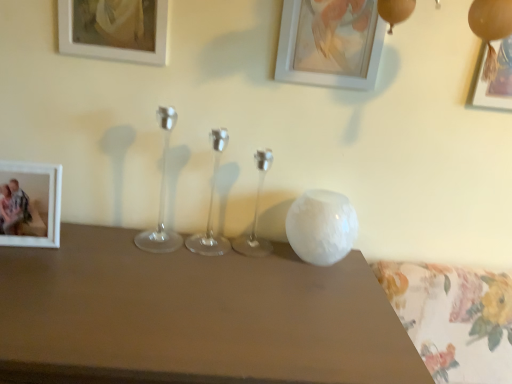
The height and width of the screenshot is (384, 512). Describe the element at coordinates (114, 29) in the screenshot. I see `matte white picture frame at upper left, the second picture frame positioned from the left` at that location.

Where is `white matte picture frame at left, which is the 1th picture frame from left to right`? white matte picture frame at left, which is the 1th picture frame from left to right is located at coordinates (30, 204).

Locate an element on the screen. white matte picture frame at upper center, which is counted as the 3th picture frame, starting from the left is located at coordinates (330, 44).

Looking at the image, does white matte picture frame at upper center, which is counted as the 2th picture frame, starting from the right, seem bigger or smaller compared to white glossy vase at upper right?

Considering their sizes, white matte picture frame at upper center, which is counted as the 2th picture frame, starting from the right, takes up less space than white glossy vase at upper right.

Can you confirm if white matte picture frame at upper center, which is counted as the 2th picture frame, starting from the right, is thinner than white glossy vase at upper right?

Yes.

Can white glossy vase at upper right be found inside white matte picture frame at upper center, which is counted as the 2th picture frame, starting from the right?

No, white glossy vase at upper right is not inside white matte picture frame at upper center, which is counted as the 2th picture frame, starting from the right.

Does white matte picture frame at upper center, which is counted as the 3th picture frame, starting from the left, lie behind white glossy vase at upper right?

Yes.

From the image's perspective, is white glossy vase at upper right on metallic gold picture frame at upper right, the 1th picture frame viewed from the right?

No.

Is point (156, 330) positioned in front of point (495, 83)?

That is True.

Locate an element on the screen. This screenshot has height=384, width=512. table located underneath the metallic gold picture frame at upper right, the 1th picture frame viewed from the right (from a real-world perspective) is located at coordinates (193, 317).

Is white glossy vase at upper right turned away from metallic gold picture frame at upper right, arranged as the fourth picture frame when viewed from the left?

No, white glossy vase at upper right is not facing away from metallic gold picture frame at upper right, arranged as the fourth picture frame when viewed from the left.

From the image's perspective, would you say white matte picture frame at upper center, which is counted as the 2th picture frame, starting from the right, is positioned over white matte picture frame at left, which is the 1th picture frame from left to right?

Yes, from the image's perspective, white matte picture frame at upper center, which is counted as the 2th picture frame, starting from the right, is over white matte picture frame at left, which is the 1th picture frame from left to right.

How distant is white matte picture frame at upper center, which is counted as the 3th picture frame, starting from the left, from white matte picture frame at left, which is the 1th picture frame from left to right?

white matte picture frame at upper center, which is counted as the 3th picture frame, starting from the left, and white matte picture frame at left, which is the 1th picture frame from left to right, are 26.77 inches apart.

Which is further, [303,79] or [24,193]?

Positioned behind is point [303,79].

From a real-world perspective, is matte white picture frame at upper left, the second picture frame positioned from the left, physically above white matte picture frame at upper center, which is counted as the 2th picture frame, starting from the right?

Yes, from a real-world perspective, matte white picture frame at upper left, the second picture frame positioned from the left, is over white matte picture frame at upper center, which is counted as the 2th picture frame, starting from the right

Is point (127, 48) more distant than point (349, 83)?

No, it is not.

Does matte white picture frame at upper left, the second picture frame positioned from the left, have a lesser height compared to white matte picture frame at upper center, which is counted as the 2th picture frame, starting from the right?

Yes, matte white picture frame at upper left, the second picture frame positioned from the left, is shorter than white matte picture frame at upper center, which is counted as the 2th picture frame, starting from the right.

Where is `the 1st picture frame positioned below the matte white picture frame at upper left, the second picture frame positioned from the left (from the image's perspective)`? The width and height of the screenshot is (512, 384). the 1st picture frame positioned below the matte white picture frame at upper left, the second picture frame positioned from the left (from the image's perspective) is located at coordinates 330,44.

From the picture: Is matte white picture frame at upper left, which ranks as the 3th picture frame in right-to-left order, beside white matte picture frame at left, which is the 1th picture frame from left to right?

No, matte white picture frame at upper left, which ranks as the 3th picture frame in right-to-left order, is not touching white matte picture frame at left, which is the 1th picture frame from left to right.

Considering the relative sizes of matte white picture frame at upper left, the second picture frame positioned from the left, and white matte picture frame at left, which is the 4th picture frame in right-to-left order, in the image provided, is matte white picture frame at upper left, the second picture frame positioned from the left, wider than white matte picture frame at left, which is the 4th picture frame in right-to-left order,?

In fact, matte white picture frame at upper left, the second picture frame positioned from the left, might be narrower than white matte picture frame at left, which is the 4th picture frame in right-to-left order.

Looking at this image, can you tell me how much matte white picture frame at upper left, the second picture frame positioned from the left, and white matte picture frame at left, which is the 4th picture frame in right-to-left order, differ in facing direction?

The angle between the facing direction of matte white picture frame at upper left, the second picture frame positioned from the left, and the facing direction of white matte picture frame at left, which is the 4th picture frame in right-to-left order, is 4.86 degrees.

From a real-world perspective, is matte white picture frame at upper left, which ranks as the 3th picture frame in right-to-left order, positioned above or below white matte picture frame at left, which is the 1th picture frame from left to right?

Clearly, from a real-world perspective, matte white picture frame at upper left, which ranks as the 3th picture frame in right-to-left order, is above white matte picture frame at left, which is the 1th picture frame from left to right.

Considering the positions of objects white matte picture frame at left, which is the 1th picture frame from left to right, and white matte picture frame at upper center, which is counted as the 3th picture frame, starting from the left, in the image provided, who is more to the right, white matte picture frame at left, which is the 1th picture frame from left to right, or white matte picture frame at upper center, which is counted as the 3th picture frame, starting from the left,?

white matte picture frame at upper center, which is counted as the 3th picture frame, starting from the left.

Who is bigger, white matte picture frame at left, which is the 4th picture frame in right-to-left order, or white matte picture frame at upper center, which is counted as the 2th picture frame, starting from the right?

With larger size is white matte picture frame at left, which is the 4th picture frame in right-to-left order.

Is white matte picture frame at left, which is the 4th picture frame in right-to-left order, aimed at white matte picture frame at upper center, which is counted as the 3th picture frame, starting from the left?

No, white matte picture frame at left, which is the 4th picture frame in right-to-left order, is not oriented towards white matte picture frame at upper center, which is counted as the 3th picture frame, starting from the left.

Is point (29, 169) positioned behind point (376, 64)?

No.

Considering the sizes of white matte picture frame at left, which is the 4th picture frame in right-to-left order, and matte white picture frame at upper left, the second picture frame positioned from the left, in the image, is white matte picture frame at left, which is the 4th picture frame in right-to-left order, taller or shorter than matte white picture frame at upper left, the second picture frame positioned from the left,?

Clearly, white matte picture frame at left, which is the 4th picture frame in right-to-left order, is shorter compared to matte white picture frame at upper left, the second picture frame positioned from the left.

From a real-world perspective, which is physically below, white matte picture frame at left, which is the 4th picture frame in right-to-left order, or matte white picture frame at upper left, which ranks as the 3th picture frame in right-to-left order?

In real-world perspective, white matte picture frame at left, which is the 4th picture frame in right-to-left order, is lower.

Which is nearer, (58, 199) or (98, 7)?

Point (58, 199) is closer to the camera than point (98, 7).

Looking at the image, does white matte picture frame at left, which is the 1th picture frame from left to right, seem bigger or smaller compared to matte white picture frame at upper left, the second picture frame positioned from the left?

Clearly, white matte picture frame at left, which is the 1th picture frame from left to right, is larger in size than matte white picture frame at upper left, the second picture frame positioned from the left.

Where is `table below the white matte picture frame at upper center, which is counted as the 3th picture frame, starting from the left (from the image's perspective)`? The image size is (512, 384). table below the white matte picture frame at upper center, which is counted as the 3th picture frame, starting from the left (from the image's perspective) is located at coordinates (193, 317).

Where is `table below the metallic gold picture frame at upper right, arranged as the fourth picture frame when viewed from the left (from a real-world perspective)`? Image resolution: width=512 pixels, height=384 pixels. table below the metallic gold picture frame at upper right, arranged as the fourth picture frame when viewed from the left (from a real-world perspective) is located at coordinates (193, 317).

Which object lies nearer to the anchor point white glossy vase at upper right, matte white picture frame at upper left, which ranks as the 3th picture frame in right-to-left order, or white matte picture frame at left, which is the 4th picture frame in right-to-left order?

white matte picture frame at left, which is the 4th picture frame in right-to-left order, lies closer to white glossy vase at upper right than the other object.

From the image, which object appears to be nearer to matte white picture frame at upper left, which ranks as the 3th picture frame in right-to-left order, white glossy vase at upper right or white matte picture frame at left, which is the 4th picture frame in right-to-left order?

Based on the image, white matte picture frame at left, which is the 4th picture frame in right-to-left order, appears to be nearer to matte white picture frame at upper left, which ranks as the 3th picture frame in right-to-left order.

Based on the photo, which object lies further to the anchor point white matte picture frame at left, which is the 4th picture frame in right-to-left order, white matte picture frame at upper center, which is counted as the 2th picture frame, starting from the right, or matte white picture frame at upper left, which ranks as the 3th picture frame in right-to-left order?

The object further to white matte picture frame at left, which is the 4th picture frame in right-to-left order, is white matte picture frame at upper center, which is counted as the 2th picture frame, starting from the right.

When comparing their distances from metallic gold picture frame at upper right, arranged as the fourth picture frame when viewed from the left, does white matte picture frame at upper center, which is counted as the 3th picture frame, starting from the left, or white glossy vase at upper right seem closer?

Based on the image, white matte picture frame at upper center, which is counted as the 3th picture frame, starting from the left, appears to be nearer to metallic gold picture frame at upper right, arranged as the fourth picture frame when viewed from the left.

Looking at this image, based on their spatial positions, is matte white picture frame at upper left, which ranks as the 3th picture frame in right-to-left order, or white glossy vase at upper right closer to metallic gold picture frame at upper right, arranged as the fourth picture frame when viewed from the left?

white glossy vase at upper right lies closer to metallic gold picture frame at upper right, arranged as the fourth picture frame when viewed from the left, than the other object.

Based on their spatial positions, is matte white picture frame at upper left, the second picture frame positioned from the left, or metallic gold picture frame at upper right, the 1th picture frame viewed from the right, closer to white glossy vase at upper right?

matte white picture frame at upper left, the second picture frame positioned from the left, is closer to white glossy vase at upper right.

Looking at this image, based on their spatial positions, is matte white picture frame at upper left, which ranks as the 3th picture frame in right-to-left order, or metallic gold picture frame at upper right, arranged as the fourth picture frame when viewed from the left, further from white matte picture frame at left, which is the 1th picture frame from left to right?

metallic gold picture frame at upper right, arranged as the fourth picture frame when viewed from the left, is positioned further to the anchor white matte picture frame at left, which is the 1th picture frame from left to right.

Estimate the real-world distances between objects in this image. Which object is closer to metallic gold picture frame at upper right, arranged as the fourth picture frame when viewed from the left, white matte picture frame at left, which is the 1th picture frame from left to right, or matte white picture frame at upper left, which ranks as the 3th picture frame in right-to-left order?

Among the two, matte white picture frame at upper left, which ranks as the 3th picture frame in right-to-left order, is located nearer to metallic gold picture frame at upper right, arranged as the fourth picture frame when viewed from the left.

The image size is (512, 384). Find the location of `table situated between matte white picture frame at upper left, which ranks as the 3th picture frame in right-to-left order, and metallic gold picture frame at upper right, the 1th picture frame viewed from the right, from left to right`. table situated between matte white picture frame at upper left, which ranks as the 3th picture frame in right-to-left order, and metallic gold picture frame at upper right, the 1th picture frame viewed from the right, from left to right is located at coordinates (193, 317).

Locate an element on the screen. This screenshot has width=512, height=384. picture frame between white matte picture frame at left, which is the 1th picture frame from left to right, and white matte picture frame at upper center, which is counted as the 2th picture frame, starting from the right is located at coordinates (114, 29).

This screenshot has width=512, height=384. I want to click on picture frame situated between matte white picture frame at upper left, which ranks as the 3th picture frame in right-to-left order, and metallic gold picture frame at upper right, the 1th picture frame viewed from the right, from left to right, so click(x=330, y=44).

In order to click on table between white matte picture frame at left, which is the 1th picture frame from left to right, and metallic gold picture frame at upper right, arranged as the fourth picture frame when viewed from the left, from left to right in this screenshot , I will do `click(193, 317)`.